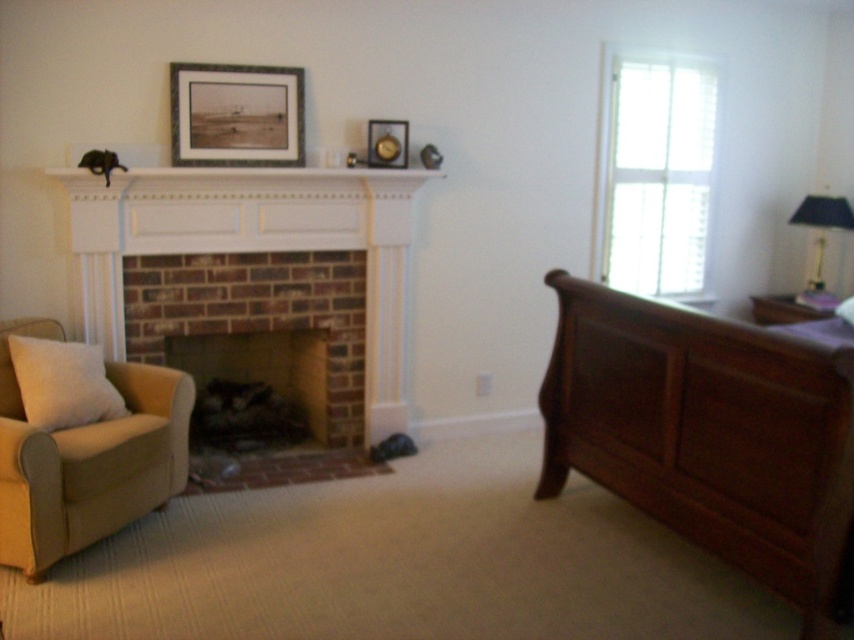
Question: Does beige fabric armchair at left appear on the left side of metallic gold picture frame at upper center?

Choices:
 (A) yes
 (B) no

Answer: (A)

Question: Among these points, which one is farthest from the camera?

Choices:
 (A) (211, 81)
 (B) (389, 134)
 (C) (644, 339)
 (D) (80, 387)

Answer: (B)

Question: Estimate the real-world distances between objects in this image. Which object is farther from the beige fabric armchair at left?

Choices:
 (A) white brick fireplace at center
 (B) metallic gold picture frame at upper center
 (C) metallic gold lamp at upper right

Answer: (C)

Question: Among these objects, which one is farthest from the camera?

Choices:
 (A) metallic gold lamp at upper right
 (B) beige fabric pillow at lower left
 (C) metallic gold picture frame at upper center

Answer: (A)

Question: Is dark wood bed at right closer to the viewer compared to matte black picture frame at upper center?

Choices:
 (A) no
 (B) yes

Answer: (B)

Question: Can you confirm if dark wood bed at right is positioned to the left of metallic gold lamp at upper right?

Choices:
 (A) yes
 (B) no

Answer: (A)